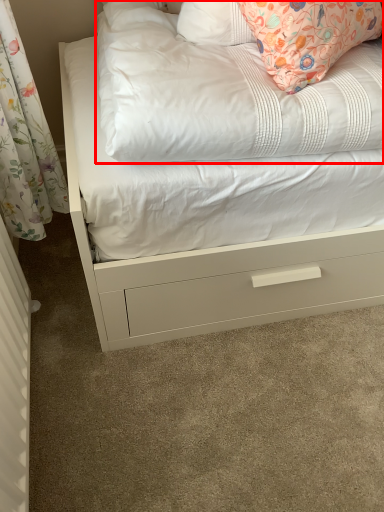
Question: From the image's perspective, where is mattress (annotated by the red box) located in relation to radiator in the image?

Choices:
 (A) below
 (B) above

Answer: (B)